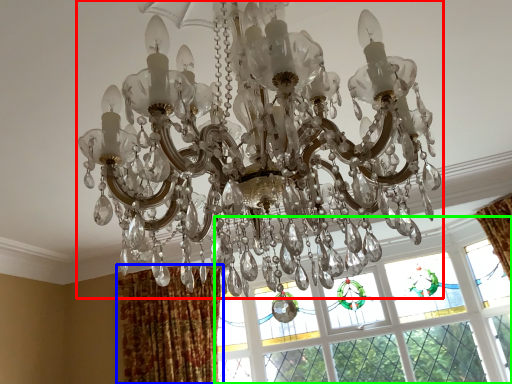
Question: Estimate the real-world distances between objects in this image. Which object is farther from lamp (highlighted by a red box), curtain (highlighted by a blue box) or window (highlighted by a green box)?

Choices:
 (A) curtain
 (B) window

Answer: (A)